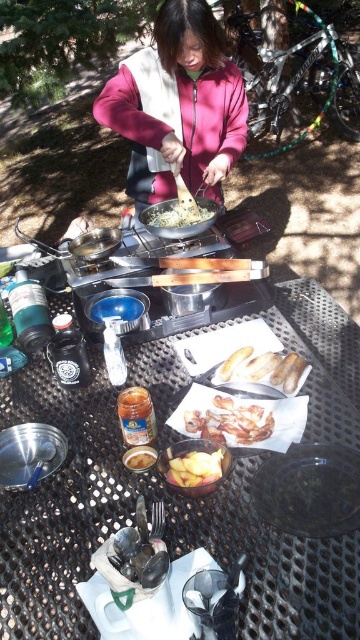
Who is lower down, shiny golden shrimp at center or yellow matte food at center?

shiny golden shrimp at center is lower down.

Between shiny golden shrimp at center and yellow matte food at center, which one has less height?

With less height is shiny golden shrimp at center.

Between point (246, 438) and point (155, 212), which one is positioned in front?

Point (246, 438)

The width and height of the screenshot is (360, 640). I want to click on shiny golden shrimp at center, so click(230, 420).

Which is above, yellow matte food at center or translucent glass jar at center?

yellow matte food at center is above.

Is yellow matte food at center smaller than translucent glass jar at center?

No.

Is point (200, 212) less distant than point (128, 461)?

No, it is behind (128, 461).

Find the location of a particular element. yellow matte food at center is located at coordinates (177, 212).

Does black metal table at center appear over golden brown bread at center?

No, black metal table at center is not above golden brown bread at center.

What are the coordinates of `black metal table at center` in the screenshot? It's located at (167, 529).